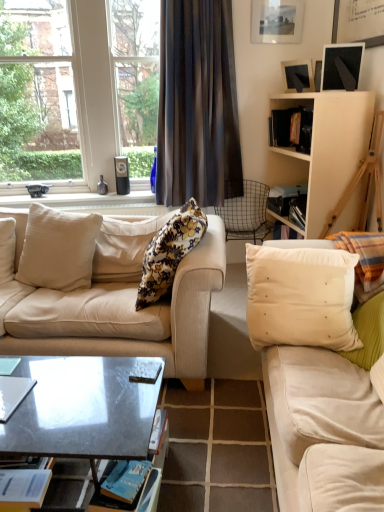
Find the location of a particular element. The width and height of the screenshot is (384, 512). empty space that is ontop of matte glass window sill at upper left (from a real-world perspective) is located at coordinates (96, 194).